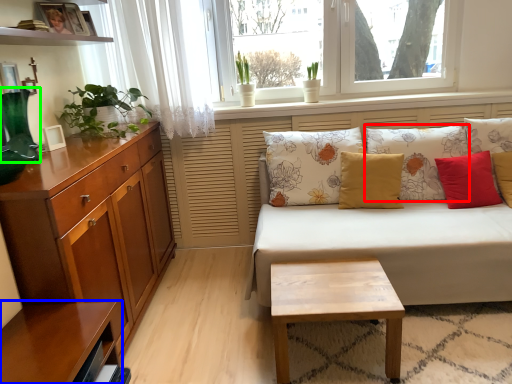
Question: Which object is positioned farthest from pillow (highlighted by a red box)? Select from shelf (highlighted by a blue box) and vase (highlighted by a green box).

Choices:
 (A) shelf
 (B) vase

Answer: (B)